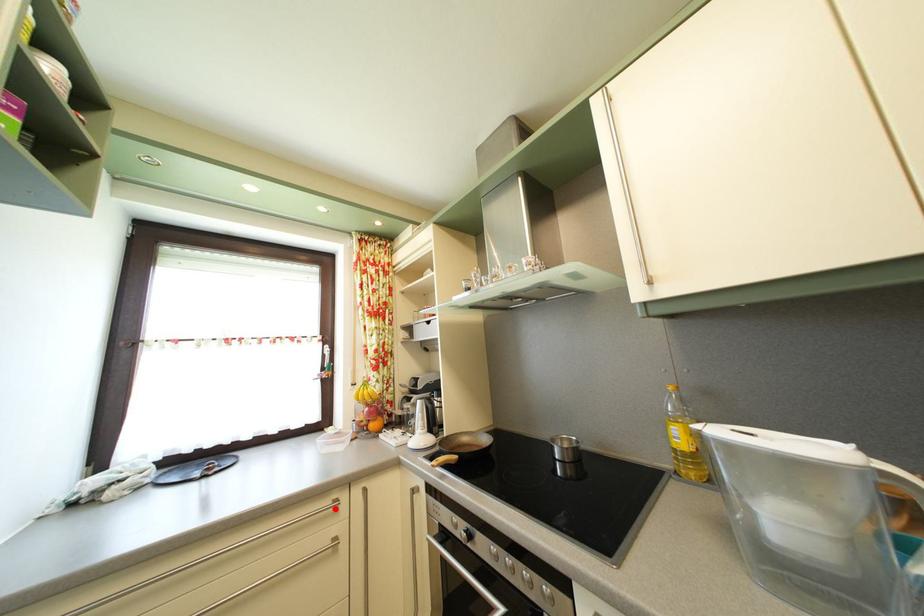
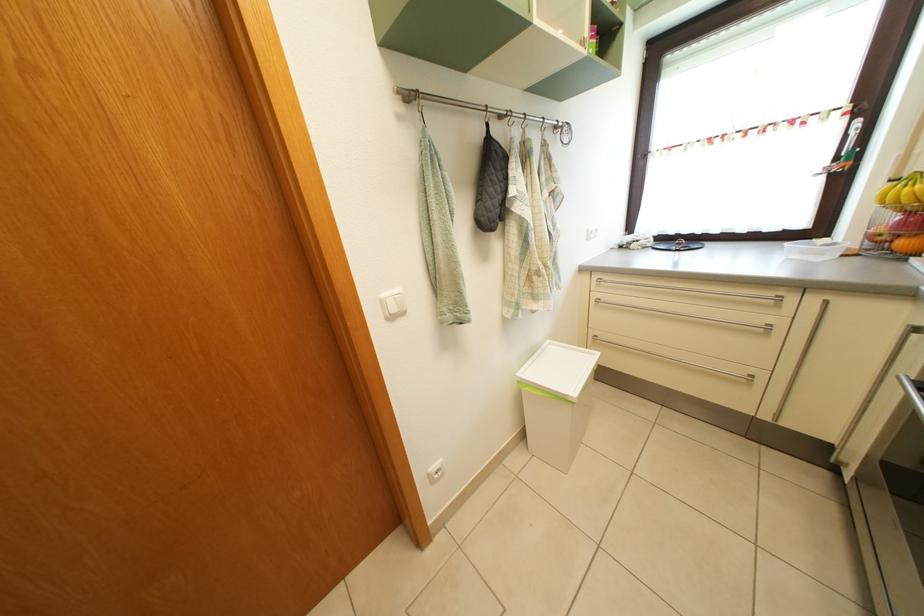
In the second image, find the point that corresponds to the highlighted location in the first image.

(776, 302)